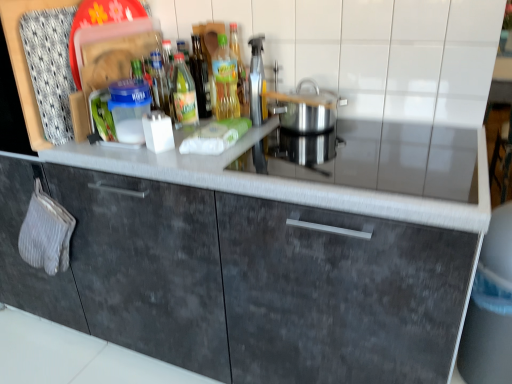
In order to face dark gray matte cabinet at center, should I rotate leftwards or rightwards?

Rotate right and turn 1.271 degrees.

The height and width of the screenshot is (384, 512). I want to click on smooth gray countertop at center, so click(283, 184).

What do you see at coordinates (183, 94) in the screenshot? The height and width of the screenshot is (384, 512). I see `green glass bottle at center, the 1th bottle in the left-to-right sequence` at bounding box center [183, 94].

Locate an element on the screen. dark gray matte cabinet at center is located at coordinates (242, 280).

Which of these two, translucent plastic bottle at center, the second bottle when ordered from left to right, or dark gray matte cabinet at center, is bigger?

With larger size is dark gray matte cabinet at center.

From a real-world perspective, is translucent plastic bottle at center, the second bottle when ordered from left to right, located higher than dark gray matte cabinet at center?

Correct, in the physical world, translucent plastic bottle at center, the second bottle when ordered from left to right, is higher than dark gray matte cabinet at center.

Is translucent plastic bottle at center, the second bottle when ordered from left to right, directly adjacent to dark gray matte cabinet at center?

No.

Considering the sizes of objects green glass bottle at center, which ranks as the second bottle in right-to-left order, and dark gray matte cabinet at center in the image provided, who is smaller, green glass bottle at center, which ranks as the second bottle in right-to-left order, or dark gray matte cabinet at center?

With smaller size is green glass bottle at center, which ranks as the second bottle in right-to-left order.

Which is nearer, (181, 112) or (357, 330)?

The point (357, 330) is closer to the camera.

Which is more to the right, green glass bottle at center, the 1th bottle in the left-to-right sequence, or dark gray matte cabinet at center?

dark gray matte cabinet at center is more to the right.

Is green glass bottle at center, which ranks as the second bottle in right-to-left order, positioned behind dark gray matte cabinet at center?

Yes, green glass bottle at center, which ranks as the second bottle in right-to-left order, is behind dark gray matte cabinet at center.

Considering the sizes of objects green glass bottle at center, the 1th bottle in the left-to-right sequence, and smooth gray countertop at center in the image provided, who is thinner, green glass bottle at center, the 1th bottle in the left-to-right sequence, or smooth gray countertop at center?

With smaller width is green glass bottle at center, the 1th bottle in the left-to-right sequence.

Based on the photo, how much distance is there between green glass bottle at center, the 1th bottle in the left-to-right sequence, and smooth gray countertop at center?

green glass bottle at center, the 1th bottle in the left-to-right sequence, is 13.83 inches away from smooth gray countertop at center.

At what (x,y) coordinates should I click in order to perform the action: click on bottle that is the 1st one above the smooth gray countertop at center (from a real-world perspective). Please return your answer as a coordinate pair (x, y). Image resolution: width=512 pixels, height=384 pixels. Looking at the image, I should click on (183, 94).

Does green glass bottle at center, the 1th bottle in the left-to-right sequence, lie in front of smooth gray countertop at center?

No, green glass bottle at center, the 1th bottle in the left-to-right sequence, is behind smooth gray countertop at center.

Between smooth gray countertop at center and translucent plastic bottle at center, the second bottle when ordered from left to right, which one has more height?

translucent plastic bottle at center, the second bottle when ordered from left to right, is taller.

Could you tell me if smooth gray countertop at center is facing translucent plastic bottle at center, the 1th bottle when ordered from right to left?

No, smooth gray countertop at center is not oriented towards translucent plastic bottle at center, the 1th bottle when ordered from right to left.

Is smooth gray countertop at center not near translucent plastic bottle at center, the second bottle when ordered from left to right?

No, there isn't a large distance between smooth gray countertop at center and translucent plastic bottle at center, the second bottle when ordered from left to right.

Where is `bottle that appears above the green glass bottle at center, the 1th bottle in the left-to-right sequence (from the image's perspective)`? The width and height of the screenshot is (512, 384). bottle that appears above the green glass bottle at center, the 1th bottle in the left-to-right sequence (from the image's perspective) is located at coordinates (x=225, y=81).

Would you say green glass bottle at center, the 1th bottle in the left-to-right sequence, is inside or outside translucent plastic bottle at center, the 1th bottle when ordered from right to left?

green glass bottle at center, the 1th bottle in the left-to-right sequence, exists outside the volume of translucent plastic bottle at center, the 1th bottle when ordered from right to left.

Consider the image. In the image, is green glass bottle at center, which ranks as the second bottle in right-to-left order, positioned in front of or behind translucent plastic bottle at center, the 1th bottle when ordered from right to left?

green glass bottle at center, which ranks as the second bottle in right-to-left order, is in front of translucent plastic bottle at center, the 1th bottle when ordered from right to left.

From the image's perspective, relative to translucent plastic bottle at center, the second bottle when ordered from left to right, is green glass bottle at center, the 1th bottle in the left-to-right sequence, above or below?

green glass bottle at center, the 1th bottle in the left-to-right sequence, is situated lower than translucent plastic bottle at center, the second bottle when ordered from left to right, in the image.

Considering their positions, is dark gray matte cabinet at center located in front of or behind translucent plastic bottle at center, the second bottle when ordered from left to right?

Clearly, dark gray matte cabinet at center is in front of translucent plastic bottle at center, the second bottle when ordered from left to right.

From a real-world perspective, which is physically above, dark gray matte cabinet at center or translucent plastic bottle at center, the second bottle when ordered from left to right?

translucent plastic bottle at center, the second bottle when ordered from left to right, is physically above.

Does dark gray matte cabinet at center have a lesser width compared to translucent plastic bottle at center, the 1th bottle when ordered from right to left?

No, dark gray matte cabinet at center is not thinner than translucent plastic bottle at center, the 1th bottle when ordered from right to left.

Considering the points (446, 340) and (230, 52), which point is in front, point (446, 340) or point (230, 52)?

The point (446, 340) is closer to the camera.

How many degrees apart are the facing directions of dark gray matte cabinet at center and silver metallic pot at center?

The facing directions of dark gray matte cabinet at center and silver metallic pot at center are 2.43 degrees apart.

Is dark gray matte cabinet at center facing away from silver metallic pot at center?

No, dark gray matte cabinet at center is not facing away from silver metallic pot at center.

Who is shorter, dark gray matte cabinet at center or silver metallic pot at center?

With less height is silver metallic pot at center.

Identify the location of cabinetry that is on the right side of translucent plastic bottle at center, the 1th bottle when ordered from right to left. This screenshot has height=384, width=512. (242, 280).

What are the coordinates of `bottle that is the 2nd one when counting leftward from the dark gray matte cabinet at center` in the screenshot? It's located at (183, 94).

From the image, which object appears to be farther from smooth gray countertop at center, dark gray matte cabinet at center or green glass bottle at center, which ranks as the second bottle in right-to-left order?

green glass bottle at center, which ranks as the second bottle in right-to-left order, is further to smooth gray countertop at center.

When comparing their distances from silver metallic pot at center, does green glass bottle at center, the 1th bottle in the left-to-right sequence, or smooth gray countertop at center seem further?

The object further to silver metallic pot at center is green glass bottle at center, the 1th bottle in the left-to-right sequence.

From the image, which object appears to be nearer to translucent plastic bottle at center, the second bottle when ordered from left to right, green glass bottle at center, which ranks as the second bottle in right-to-left order, or silver metallic pot at center?

green glass bottle at center, which ranks as the second bottle in right-to-left order, lies closer to translucent plastic bottle at center, the second bottle when ordered from left to right, than the other object.

Estimate the real-world distances between objects in this image. Which object is closer to silver metallic pot at center, green glass bottle at center, which ranks as the second bottle in right-to-left order, or translucent plastic bottle at center, the 1th bottle when ordered from right to left?

Based on the image, translucent plastic bottle at center, the 1th bottle when ordered from right to left, appears to be nearer to silver metallic pot at center.

Estimate the real-world distances between objects in this image. Which object is further from silver metallic pot at center, dark gray matte cabinet at center or green glass bottle at center, the 1th bottle in the left-to-right sequence?

Among the two, dark gray matte cabinet at center is located further to silver metallic pot at center.

When comparing their distances from silver metallic pot at center, does dark gray matte cabinet at center or translucent plastic bottle at center, the 1th bottle when ordered from right to left, seem closer?

Based on the image, translucent plastic bottle at center, the 1th bottle when ordered from right to left, appears to be nearer to silver metallic pot at center.

From the image, which object appears to be farther from dark gray matte cabinet at center, silver metallic pot at center or translucent plastic bottle at center, the second bottle when ordered from left to right?

translucent plastic bottle at center, the second bottle when ordered from left to right, lies further to dark gray matte cabinet at center than the other object.

Looking at the image, which one is located closer to dark gray matte cabinet at center, translucent plastic bottle at center, the second bottle when ordered from left to right, or smooth gray countertop at center?

smooth gray countertop at center lies closer to dark gray matte cabinet at center than the other object.

Where is `home appliance that lies between translucent plastic bottle at center, the 1th bottle when ordered from right to left, and dark gray matte cabinet at center from top to bottom`? The width and height of the screenshot is (512, 384). home appliance that lies between translucent plastic bottle at center, the 1th bottle when ordered from right to left, and dark gray matte cabinet at center from top to bottom is located at coordinates (306, 109).

Locate an element on the screen. The width and height of the screenshot is (512, 384). home appliance between green glass bottle at center, which ranks as the second bottle in right-to-left order, and dark gray matte cabinet at center, in the vertical direction is located at coordinates (306, 109).

This screenshot has width=512, height=384. What are the coordinates of `bottle between translucent plastic bottle at center, the 1th bottle when ordered from right to left, and dark gray matte cabinet at center vertically` in the screenshot? It's located at (183, 94).

I want to click on home appliance between green glass bottle at center, which ranks as the second bottle in right-to-left order, and smooth gray countertop at center, so click(x=306, y=109).